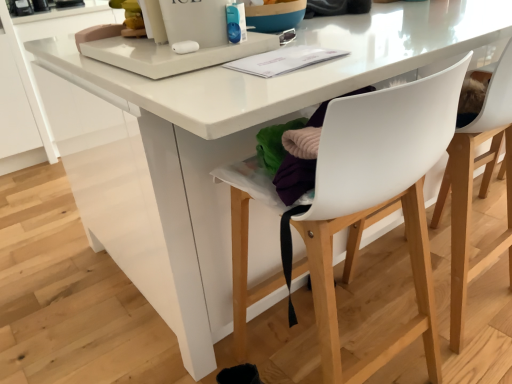
Question: Considering the relative sizes of white plastic chair at center, arranged as the first chair when viewed from the left, and white plastic chair at center, the first chair from the right, in the image provided, is white plastic chair at center, arranged as the first chair when viewed from the left, wider than white plastic chair at center, the first chair from the right,?

Choices:
 (A) no
 (B) yes

Answer: (B)

Question: From the image's perspective, is white plastic chair at center, the second chair from the right, under white plastic chair at center, acting as the 2th chair starting from the left?

Choices:
 (A) no
 (B) yes

Answer: (B)

Question: From the image's perspective, is white plastic chair at center, the second chair from the right, over white plastic chair at center, acting as the 2th chair starting from the left?

Choices:
 (A) yes
 (B) no

Answer: (B)

Question: From a real-world perspective, is white plastic chair at center, arranged as the first chair when viewed from the left, below white plastic chair at center, acting as the 2th chair starting from the left?

Choices:
 (A) no
 (B) yes

Answer: (A)

Question: Is white plastic chair at center, arranged as the first chair when viewed from the left, looking in the opposite direction of white plastic chair at center, acting as the 2th chair starting from the left?

Choices:
 (A) no
 (B) yes

Answer: (A)

Question: Can you confirm if white plastic chair at center, arranged as the first chair when viewed from the left, is shorter than white plastic chair at center, acting as the 2th chair starting from the left?

Choices:
 (A) yes
 (B) no

Answer: (A)

Question: Is white plastic chair at center, arranged as the first chair when viewed from the left, completely or partially inside white plastic chair at center, acting as the 2th chair starting from the left?

Choices:
 (A) no
 (B) yes

Answer: (A)

Question: Is white plastic chair at center, acting as the 2th chair starting from the left, facing towards white plastic chair at center, arranged as the first chair when viewed from the left?

Choices:
 (A) yes
 (B) no

Answer: (B)

Question: Considering the relative positions of white plastic chair at center, acting as the 2th chair starting from the left, and white plastic chair at center, arranged as the first chair when viewed from the left, in the image provided, is white plastic chair at center, acting as the 2th chair starting from the left, to the right of white plastic chair at center, arranged as the first chair when viewed from the left, from the viewer's perspective?

Choices:
 (A) no
 (B) yes

Answer: (B)

Question: From the image's perspective, is white plastic chair at center, acting as the 2th chair starting from the left, under white plastic chair at center, the second chair from the right?

Choices:
 (A) no
 (B) yes

Answer: (A)

Question: Is white plastic chair at center, acting as the 2th chair starting from the left, located outside white plastic chair at center, the second chair from the right?

Choices:
 (A) no
 (B) yes

Answer: (B)

Question: Is white plastic chair at center, the first chair from the right, positioned behind white plastic chair at center, arranged as the first chair when viewed from the left?

Choices:
 (A) no
 (B) yes

Answer: (B)

Question: In terms of height, does white plastic chair at center, the first chair from the right, look taller or shorter compared to white plastic chair at center, the second chair from the right?

Choices:
 (A) tall
 (B) short

Answer: (A)